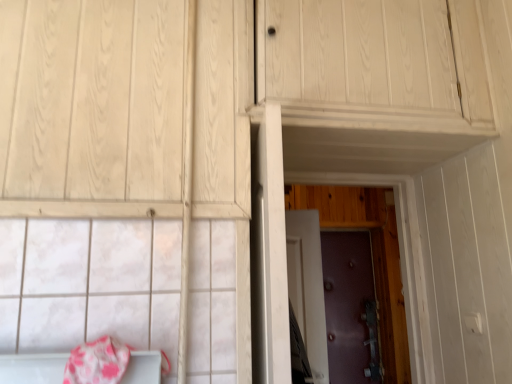
Identify the location of purple textured door at center, arranged as the 3th door when viewed from the back. The height and width of the screenshot is (384, 512). (372, 257).

Identify the location of pink fabric blanket at lower left. Image resolution: width=512 pixels, height=384 pixels. (97, 362).

From a real-world perspective, is purple matte door at center, the second door viewed from the front, above or below purple leather door at center, marked as the third door in a front-to-back arrangement?

purple matte door at center, the second door viewed from the front, is below purple leather door at center, marked as the third door in a front-to-back arrangement.

Are purple matte door at center, the second door viewed from the front, and purple leather door at center, the first door positioned from the back, far apart?

purple matte door at center, the second door viewed from the front, is far away from purple leather door at center, the first door positioned from the back.

Does purple matte door at center, the second door from the back, have a lesser width compared to purple leather door at center, marked as the third door in a front-to-back arrangement?

No, purple matte door at center, the second door from the back, is not thinner than purple leather door at center, marked as the third door in a front-to-back arrangement.

Which of these two, purple textured door at center, arranged as the first door when viewed from the front, or pink fabric blanket at lower left, is bigger?

purple textured door at center, arranged as the first door when viewed from the front, is bigger.

In the scene shown: Is purple textured door at center, arranged as the first door when viewed from the front, facing away from pink fabric blanket at lower left?

No, purple textured door at center, arranged as the first door when viewed from the front, is not facing away from pink fabric blanket at lower left.

Which object is further away from the camera taking this photo, purple textured door at center, arranged as the 3th door when viewed from the back, or pink fabric blanket at lower left?

Positioned behind is purple textured door at center, arranged as the 3th door when viewed from the back.

From the image's perspective, which is below, purple textured door at center, arranged as the first door when viewed from the front, or pink fabric blanket at lower left?

pink fabric blanket at lower left is shown below in the image.

Is purple leather door at center, marked as the third door in a front-to-back arrangement, facing away from purple textured door at center, arranged as the first door when viewed from the front?

No, purple leather door at center, marked as the third door in a front-to-back arrangement,'s orientation is not away from purple textured door at center, arranged as the first door when viewed from the front.

Does purple leather door at center, the first door positioned from the back, have a smaller size compared to purple textured door at center, arranged as the 3th door when viewed from the back?

Correct, purple leather door at center, the first door positioned from the back, occupies less space than purple textured door at center, arranged as the 3th door when viewed from the back.

What's the angular difference between purple leather door at center, the first door positioned from the back, and purple textured door at center, arranged as the first door when viewed from the front,'s facing directions?

There is a 1.6-degree angle between the facing directions of purple leather door at center, the first door positioned from the back, and purple textured door at center, arranged as the first door when viewed from the front.

Which is less distant, (117, 356) or (332, 355)?

Point (117, 356) appears to be closer to the viewer than point (332, 355).

Choose the correct answer: Is pink fabric blanket at lower left inside purple leather door at center, marked as the third door in a front-to-back arrangement, or outside it?

pink fabric blanket at lower left exists outside the volume of purple leather door at center, marked as the third door in a front-to-back arrangement.

From a real-world perspective, who is located lower, pink fabric blanket at lower left or purple leather door at center, marked as the third door in a front-to-back arrangement?

In real-world perspective, purple leather door at center, marked as the third door in a front-to-back arrangement, is lower.

Can you confirm if pink fabric blanket at lower left is positioned to the left of purple leather door at center, marked as the third door in a front-to-back arrangement?

Yes, pink fabric blanket at lower left is to the left of purple leather door at center, marked as the third door in a front-to-back arrangement.

Considering the sizes of purple leather door at center, the first door positioned from the back, and purple matte door at center, the second door from the back, in the image, is purple leather door at center, the first door positioned from the back, wider or thinner than purple matte door at center, the second door from the back,?

Considering their sizes, purple leather door at center, the first door positioned from the back, looks slimmer than purple matte door at center, the second door from the back.

Consider the image. Is purple matte door at center, the second door viewed from the front, surrounded by purple leather door at center, marked as the third door in a front-to-back arrangement?

No.

From a real-world perspective, is purple leather door at center, the first door positioned from the back, positioned under purple matte door at center, the second door viewed from the front, based on gravity?

No.

Considering the relative sizes of purple leather door at center, the first door positioned from the back, and purple matte door at center, the second door from the back, in the image provided, is purple leather door at center, the first door positioned from the back, bigger than purple matte door at center, the second door from the back,?

Yes.

Would you say purple leather door at center, marked as the third door in a front-to-back arrangement, is inside or outside pink fabric blanket at lower left?

purple leather door at center, marked as the third door in a front-to-back arrangement, is not enclosed by pink fabric blanket at lower left.

Is purple leather door at center, marked as the third door in a front-to-back arrangement, positioned in front of pink fabric blanket at lower left?

No, purple leather door at center, marked as the third door in a front-to-back arrangement, is further to the viewer.

Between purple leather door at center, the first door positioned from the back, and pink fabric blanket at lower left, which one appears on the left side from the viewer's perspective?

Positioned to the left is pink fabric blanket at lower left.

From the picture: Is purple leather door at center, the first door positioned from the back, facing towards pink fabric blanket at lower left?

No, purple leather door at center, the first door positioned from the back, is not turned towards pink fabric blanket at lower left.

Looking at this image, considering the sizes of objects purple textured door at center, arranged as the first door when viewed from the front, and purple matte door at center, the second door from the back, in the image provided, who is taller, purple textured door at center, arranged as the first door when viewed from the front, or purple matte door at center, the second door from the back,?

With more height is purple textured door at center, arranged as the first door when viewed from the front.

Is purple textured door at center, arranged as the first door when viewed from the front, next to purple matte door at center, the second door viewed from the front?

No, purple textured door at center, arranged as the first door when viewed from the front, is not making contact with purple matte door at center, the second door viewed from the front.

In the scene shown: Considering the sizes of objects purple textured door at center, arranged as the first door when viewed from the front, and purple matte door at center, the second door from the back, in the image provided, who is bigger, purple textured door at center, arranged as the first door when viewed from the front, or purple matte door at center, the second door from the back,?

Bigger between the two is purple textured door at center, arranged as the first door when viewed from the front.

Between point (384, 188) and point (323, 378), which one is positioned in front?

Positioned in front is point (323, 378).

There is a purple matte door at center, the second door from the back. Identify the location of the 1st door above it (from a real-world perspective). The height and width of the screenshot is (384, 512). (349, 307).

The image size is (512, 384). What are the coordinates of `blanket below the purple textured door at center, arranged as the first door when viewed from the front (from the image's perspective)` in the screenshot? It's located at (97, 362).

When comparing their distances from pink fabric blanket at lower left, does purple leather door at center, marked as the third door in a front-to-back arrangement, or purple textured door at center, arranged as the first door when viewed from the front, seem further?

Based on the image, purple leather door at center, marked as the third door in a front-to-back arrangement, appears to be further to pink fabric blanket at lower left.

Looking at the image, which one is located closer to purple leather door at center, marked as the third door in a front-to-back arrangement, purple matte door at center, the second door viewed from the front, or purple textured door at center, arranged as the 3th door when viewed from the back?

purple textured door at center, arranged as the 3th door when viewed from the back, is positioned closer to the anchor purple leather door at center, marked as the third door in a front-to-back arrangement.

From the image, which object appears to be farther from purple matte door at center, the second door from the back, purple textured door at center, arranged as the 3th door when viewed from the back, or purple leather door at center, marked as the third door in a front-to-back arrangement?

Among the two, purple leather door at center, marked as the third door in a front-to-back arrangement, is located further to purple matte door at center, the second door from the back.

Considering their positions, is pink fabric blanket at lower left positioned further to purple leather door at center, marked as the third door in a front-to-back arrangement, than purple matte door at center, the second door viewed from the front?

pink fabric blanket at lower left is positioned further to the anchor purple leather door at center, marked as the third door in a front-to-back arrangement.

From the image, which object appears to be farther from purple textured door at center, arranged as the first door when viewed from the front, purple matte door at center, the second door from the back, or purple leather door at center, marked as the third door in a front-to-back arrangement?

purple matte door at center, the second door from the back, lies further to purple textured door at center, arranged as the first door when viewed from the front, than the other object.

Looking at the image, which one is located closer to purple leather door at center, the first door positioned from the back, purple textured door at center, arranged as the 3th door when viewed from the back, or purple matte door at center, the second door viewed from the front?

Based on the image, purple textured door at center, arranged as the 3th door when viewed from the back, appears to be nearer to purple leather door at center, the first door positioned from the back.

When comparing their distances from purple matte door at center, the second door viewed from the front, does purple textured door at center, arranged as the 3th door when viewed from the back, or pink fabric blanket at lower left seem further?

Based on the image, pink fabric blanket at lower left appears to be further to purple matte door at center, the second door viewed from the front.

Estimate the real-world distances between objects in this image. Which object is closer to pink fabric blanket at lower left, purple textured door at center, arranged as the 3th door when viewed from the back, or purple leather door at center, the first door positioned from the back?

Among the two, purple textured door at center, arranged as the 3th door when viewed from the back, is located nearer to pink fabric blanket at lower left.

Where is `door located between pink fabric blanket at lower left and purple matte door at center, the second door viewed from the front, in the depth direction`? door located between pink fabric blanket at lower left and purple matte door at center, the second door viewed from the front, in the depth direction is located at coordinates (372, 257).

Where is `door between purple textured door at center, arranged as the first door when viewed from the front, and purple leather door at center, marked as the third door in a front-to-back arrangement, from front to back`? The image size is (512, 384). door between purple textured door at center, arranged as the first door when viewed from the front, and purple leather door at center, marked as the third door in a front-to-back arrangement, from front to back is located at coordinates (308, 287).